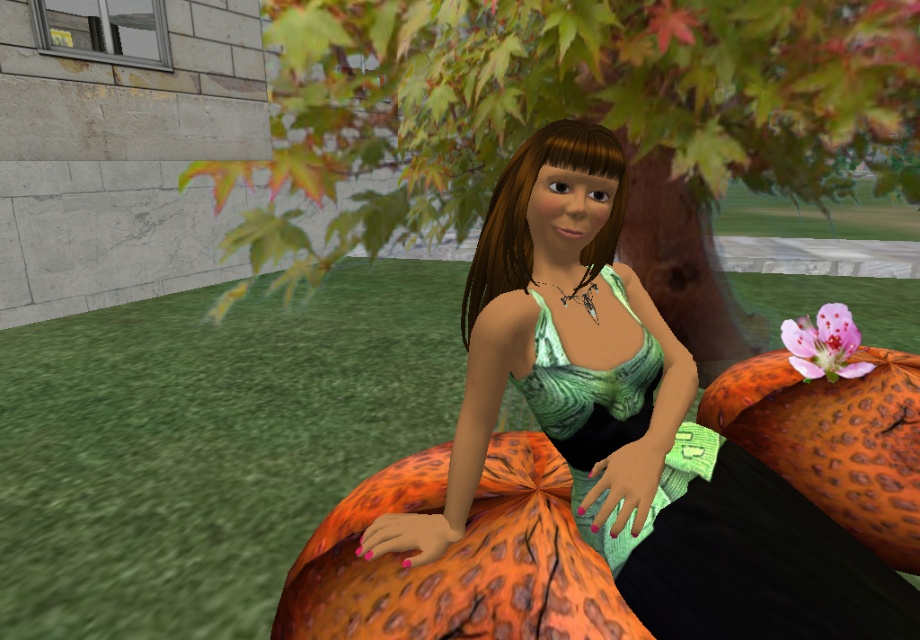
Question: Is green grass at lower left wider than green matte dress at center?

Choices:
 (A) no
 (B) yes

Answer: (B)

Question: Which object is positioned closest to the green leafy tree at center?

Choices:
 (A) pink matte flower at upper right
 (B) green matte dress at center
 (C) green grass at lower left

Answer: (C)

Question: Which of the following is the closest to the observer?

Choices:
 (A) (444, 19)
 (B) (805, 342)
 (C) (9, 536)

Answer: (B)

Question: Is green matte dress at center above pink matte flower at upper right?

Choices:
 (A) yes
 (B) no

Answer: (B)

Question: Can you confirm if green leafy tree at center is thinner than green matte dress at center?

Choices:
 (A) yes
 (B) no

Answer: (B)

Question: Which of the following is the farthest from the observer?

Choices:
 (A) pink matte flower at upper right
 (B) green matte dress at center
 (C) green leafy tree at center

Answer: (A)